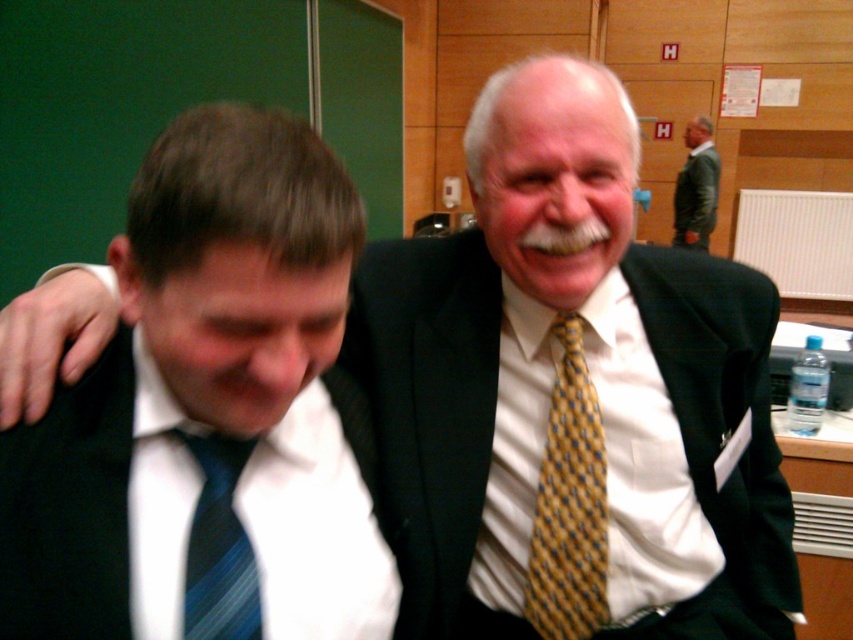
Where is `matte black suit at left`? matte black suit at left is located at coordinates (206, 412).

Measure the distance between matte black suit at left and camera.

matte black suit at left is 17.63 inches from camera.

Is point (235, 323) closer to camera compared to point (585, 513)?

Yes, it is in front of point (585, 513).

Where is `matte black suit at left`? matte black suit at left is located at coordinates (206, 412).

Is matte black suit at left bigger than blue striped tie at left?

Yes, matte black suit at left is bigger than blue striped tie at left.

The height and width of the screenshot is (640, 853). Identify the location of matte black suit at left. (206, 412).

Does point (0, 545) come farther from viewer compared to point (212, 577)?

That is False.

You are a GUI agent. You are given a task and a screenshot of the screen. Output one action in this format:
    pyautogui.click(x=<x>, y=<y>)
    Task: Click on the matte black suit at left
    
    Given the screenshot: What is the action you would take?
    pyautogui.click(x=206, y=412)

Who is positioned more to the left, yellow dotted tie at center or green leather jacket at upper right?

yellow dotted tie at center is more to the left.

Which is in front, point (558, 337) or point (705, 241)?

Positioned in front is point (558, 337).

Describe the element at coordinates (569, 502) in the screenshot. Image resolution: width=853 pixels, height=640 pixels. I see `yellow dotted tie at center` at that location.

I want to click on yellow dotted tie at center, so click(x=569, y=502).